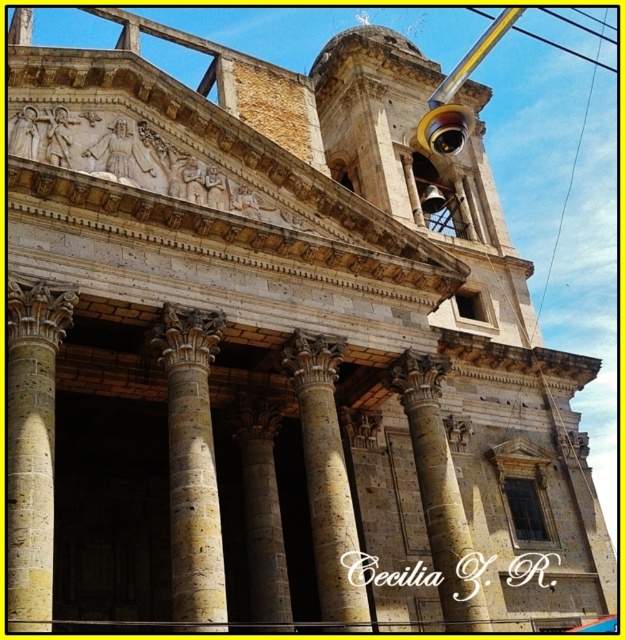
You are standing at the entrance of the grand architectural structure and want to take a photo of the point at coordinates point [200,493]. If your camera has a maximum focus range of 40 meters, will it be able to capture the point clearly?

The distance of point [200,493] from camera is 39.71 meters, which is within the camera maximum focus range of 40 meters. So yes, the camera can capture the point clearly.

You are standing in front of the grand architectural structure and want to take a photo that includes both the stone column at left and the marble column at center. Which column should you position closer to the left side of your camera frame?

The stone column at left should be positioned closer to the left side of your camera frame because it is located to the left of the marble column at center in the scene.

You are a maintenance worker needing to replace a damaged column. You have a ladder that is 10 meters long. Can you safely place the ladder between the yellow stone column at center and the brown stone column at center to reach the damaged column?

The yellow stone column at center and brown stone column at center are 9.79 meters apart from each other. Since the ladder is 10 meters long, it can be safely placed between them to reach the damaged column as the distance between the columns is less than the ladder length.